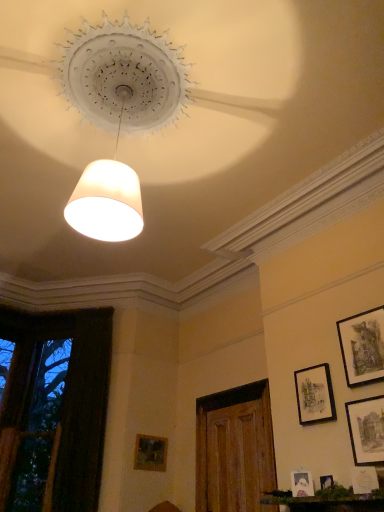
The width and height of the screenshot is (384, 512). What do you see at coordinates (234, 449) in the screenshot?
I see `wooden door at center` at bounding box center [234, 449].

Measure the distance between point [295,483] and camera.

Point [295,483] is 3.01 meters away from camera.

Find the location of a particular element. The width and height of the screenshot is (384, 512). matte white picture frame at lower right, arranged as the 3th picture frame when viewed from the front is located at coordinates (302, 484).

Describe the element at coordinates (366, 430) in the screenshot. The width and height of the screenshot is (384, 512). I see `matte black picture frame at lower right, the 2th picture frame from the right` at that location.

What do you see at coordinates (150, 453) in the screenshot? I see `wooden picture frame at lower center, which appears as the first picture frame when viewed from the back` at bounding box center [150, 453].

Where is `transparent glass window at left`? The width and height of the screenshot is (384, 512). transparent glass window at left is located at coordinates (53, 408).

Based on the photo, from a real-world perspective, relative to transparent glass window at left, is matte black picture frame at lower right, which ranks as the second picture frame in front-to-back order, vertically above or below?

From a real-world perspective, matte black picture frame at lower right, which ranks as the second picture frame in front-to-back order, is physically below transparent glass window at left.

In terms of size, does matte black picture frame at lower right, which ranks as the second picture frame in front-to-back order, appear bigger or smaller than transparent glass window at left?

Clearly, matte black picture frame at lower right, which ranks as the second picture frame in front-to-back order, is smaller in size than transparent glass window at left.

From the image's perspective, relative to transparent glass window at left, is matte black picture frame at lower right, which ranks as the second picture frame in front-to-back order, above or below?

matte black picture frame at lower right, which ranks as the second picture frame in front-to-back order, is above transparent glass window at left.

Can you confirm if matte black picture frame at lower right, which appears as the sixth picture frame when viewed from the left, is positioned to the left of transparent glass window at left?

In fact, matte black picture frame at lower right, which appears as the sixth picture frame when viewed from the left, is to the right of transparent glass window at left.

Is matte black picture frame at lower right, which is counted as the second picture frame, starting from the back, thinner than white matte lampshade at upper center?

Correct, the width of matte black picture frame at lower right, which is counted as the second picture frame, starting from the back, is less than that of white matte lampshade at upper center.

Is matte black picture frame at lower right, which is counted as the second picture frame, starting from the back, aimed at white matte lampshade at upper center?

Yes, matte black picture frame at lower right, which is counted as the second picture frame, starting from the back, is aimed at white matte lampshade at upper center.

Which of these two, matte black picture frame at lower right, which is the 4th picture frame in right-to-left order, or white matte lampshade at upper center, stands shorter?

Standing shorter between the two is matte black picture frame at lower right, which is the 4th picture frame in right-to-left order.

From the image's perspective, between matte black picture frame at lower right, acting as the sixth picture frame starting from the front, and white matte lampshade at upper center, who is located below?

matte black picture frame at lower right, acting as the sixth picture frame starting from the front.

Is matte black picture frame at lower right, the 2th picture frame from the right, looking in the opposite direction of matte white picture frame at lower right, which is counted as the 1th picture frame, starting from the front?

No, matte black picture frame at lower right, the 2th picture frame from the right, is not facing away from matte white picture frame at lower right, which is counted as the 1th picture frame, starting from the front.

Does matte black picture frame at lower right, the 2th picture frame from the right, appear on the right side of matte white picture frame at lower right, the 7th picture frame positioned from the back?

Yes, matte black picture frame at lower right, the 2th picture frame from the right, is to the right of matte white picture frame at lower right, the 7th picture frame positioned from the back.

From the image's perspective, which one is positioned lower, matte black picture frame at lower right, which ranks as the second picture frame in front-to-back order, or matte white picture frame at lower right, the 7th picture frame positioned from the back?

matte white picture frame at lower right, the 7th picture frame positioned from the back, appears lower in the image.

From the image's perspective, is white matte lampshade at upper center on wooden picture frame at lower center, which appears as the 7th picture frame when viewed from the front?

Yes, from the image's perspective, white matte lampshade at upper center is over wooden picture frame at lower center, which appears as the 7th picture frame when viewed from the front.

How far apart are white matte lampshade at upper center and wooden picture frame at lower center, which ranks as the first picture frame in left-to-right order?

A distance of 11.65 feet exists between white matte lampshade at upper center and wooden picture frame at lower center, which ranks as the first picture frame in left-to-right order.

Can you confirm if white matte lampshade at upper center is thinner than wooden picture frame at lower center, which ranks as the first picture frame in left-to-right order?

No.

Is white matte lampshade at upper center located outside wooden picture frame at lower center, which appears as the first picture frame when viewed from the back?

Absolutely, white matte lampshade at upper center is external to wooden picture frame at lower center, which appears as the first picture frame when viewed from the back.

Can you confirm if matte black picture frame at lower right, which appears as the sixth picture frame when viewed from the left, is bigger than matte black picture frame at lower right, acting as the 4th picture frame starting from the left?

Incorrect, matte black picture frame at lower right, which appears as the sixth picture frame when viewed from the left, is not larger than matte black picture frame at lower right, acting as the 4th picture frame starting from the left.

How distant is matte black picture frame at lower right, which appears as the sixth picture frame when viewed from the left, from matte black picture frame at lower right, acting as the sixth picture frame starting from the front?

A distance of 12.08 inches exists between matte black picture frame at lower right, which appears as the sixth picture frame when viewed from the left, and matte black picture frame at lower right, acting as the sixth picture frame starting from the front.

Which is more to the right, matte black picture frame at lower right, the sixth picture frame positioned from the back, or matte black picture frame at lower right, acting as the 4th picture frame starting from the left?

matte black picture frame at lower right, the sixth picture frame positioned from the back, is more to the right.

Is matte black picture frame at lower right, which ranks as the second picture frame in front-to-back order, situated inside matte black picture frame at lower right, acting as the 4th picture frame starting from the left, or outside?

The correct answer is: outside.

Is point (319, 403) closer to camera compared to point (354, 472)?

No, (319, 403) is further to viewer.

How distant is matte black picture frame at lower right, acting as the 4th picture frame starting from the left, from matte white picture frame at lower right, which appears as the 5th picture frame when viewed from the left?

They are 22.30 inches apart.

Is matte black picture frame at lower right, acting as the 4th picture frame starting from the left, positioned far away from matte white picture frame at lower right, which appears as the 5th picture frame when viewed from the left?

No, matte black picture frame at lower right, acting as the 4th picture frame starting from the left, is not far away from matte white picture frame at lower right, which appears as the 5th picture frame when viewed from the left.

Considering the relative sizes of matte black picture frame at lower right, which is counted as the second picture frame, starting from the back, and matte white picture frame at lower right, the 7th picture frame positioned from the back, in the image provided, is matte black picture frame at lower right, which is counted as the second picture frame, starting from the back, smaller than matte white picture frame at lower right, the 7th picture frame positioned from the back,?

Actually, matte black picture frame at lower right, which is counted as the second picture frame, starting from the back, might be larger than matte white picture frame at lower right, the 7th picture frame positioned from the back.

Does matte black picture frame at lower right, which ranks as the fifth picture frame in front-to-back order, touch transparent glass window at left?

matte black picture frame at lower right, which ranks as the fifth picture frame in front-to-back order, and transparent glass window at left are clearly separated.

Which of these two, matte black picture frame at lower right, the 3th picture frame positioned from the back, or transparent glass window at left, is bigger?

Bigger between the two is transparent glass window at left.

Could you tell me if matte black picture frame at lower right, positioned as the 3th picture frame in left-to-right order, is turned towards transparent glass window at left?

No, matte black picture frame at lower right, positioned as the 3th picture frame in left-to-right order, is not turned towards transparent glass window at left.

From the image's perspective, is matte black picture frame at lower right, acting as the fifth picture frame starting from the right, positioned above or below transparent glass window at left?

Based on their image positions, matte black picture frame at lower right, acting as the fifth picture frame starting from the right, is located above transparent glass window at left.

This screenshot has width=384, height=512. What are the coordinates of `the 4th picture frame positioned above the transparent glass window at left (from the image's perspective)` in the screenshot? It's located at (366, 430).

Where is `lamp in front of the matte black picture frame at lower right, acting as the sixth picture frame starting from the front`? The image size is (384, 512). lamp in front of the matte black picture frame at lower right, acting as the sixth picture frame starting from the front is located at coordinates (119, 116).

Looking at the image, which one is located further to white matte lampshade at upper center, matte black picture frame at lower right, acting as the 4th picture frame starting from the left, or watercolor paper picture frame at upper right, which is the first picture frame in right-to-left order?

Based on the image, matte black picture frame at lower right, acting as the 4th picture frame starting from the left, appears to be further to white matte lampshade at upper center.

Which object lies further to the anchor point wooden door at center, matte black picture frame at lower right, acting as the 4th picture frame starting from the left, or matte black picture frame at lower right, which ranks as the second picture frame in front-to-back order?

matte black picture frame at lower right, which ranks as the second picture frame in front-to-back order, is further to wooden door at center.

Considering their positions, is matte white picture frame at lower right, which is the 6th picture frame in right-to-left order, positioned closer to matte white picture frame at lower right, which is counted as the 1th picture frame, starting from the front, than watercolor paper picture frame at upper right, the 7th picture frame when ordered from left to right?

matte white picture frame at lower right, which is the 6th picture frame in right-to-left order.

Based on their spatial positions, is transparent glass window at left or wooden picture frame at lower center, which appears as the first picture frame when viewed from the back, further from matte black picture frame at lower right, which appears as the sixth picture frame when viewed from the left?

transparent glass window at left is further to matte black picture frame at lower right, which appears as the sixth picture frame when viewed from the left.

Looking at the image, which one is located further to wooden picture frame at lower center, which appears as the seventh picture frame when viewed from the right, watercolor paper picture frame at upper right, placed as the 4th picture frame when sorted from back to front, or white matte lampshade at upper center?

Based on the image, white matte lampshade at upper center appears to be further to wooden picture frame at lower center, which appears as the seventh picture frame when viewed from the right.

Consider the image. Considering their positions, is matte black picture frame at lower right, the sixth picture frame positioned from the back, positioned further to watercolor paper picture frame at upper right, placed as the 4th picture frame when sorted from back to front, than matte black picture frame at lower right, the 3th picture frame positioned from the back?

matte black picture frame at lower right, the 3th picture frame positioned from the back, lies further to watercolor paper picture frame at upper right, placed as the 4th picture frame when sorted from back to front, than the other object.

Which object lies further to the anchor point matte black picture frame at lower right, which is counted as the second picture frame, starting from the back, white matte lampshade at upper center or wooden picture frame at lower center, which appears as the first picture frame when viewed from the back?

white matte lampshade at upper center.

When comparing their distances from matte white picture frame at lower right, which appears as the 5th picture frame when viewed from the left, does matte black picture frame at lower right, acting as the fifth picture frame starting from the right, or wooden picture frame at lower center, which ranks as the first picture frame in left-to-right order, seem further?

wooden picture frame at lower center, which ranks as the first picture frame in left-to-right order.

Find the location of a particular element. The image size is (384, 512). glass door situated between wooden picture frame at lower center, which appears as the 7th picture frame when viewed from the front, and watercolor paper picture frame at upper right, the 7th picture frame when ordered from left to right, from left to right is located at coordinates (234, 449).

You are a GUI agent. You are given a task and a screenshot of the screen. Output one action in this format:
    pyautogui.click(x=<x>, y=<y>)
    Task: Click on the glass door positioned between matte black picture frame at lower right, the 2th picture frame from the right, and wooden picture frame at lower center, which appears as the first picture frame when viewed from the back, from near to far
    This screenshot has height=512, width=384.
    Given the screenshot: What is the action you would take?
    pyautogui.click(x=234, y=449)

Locate an element on the screen. The width and height of the screenshot is (384, 512). picture frame between matte black picture frame at lower right, the 3th picture frame positioned from the back, and wooden picture frame at lower center, which appears as the 7th picture frame when viewed from the front, in the front-back direction is located at coordinates (314, 395).

You are a GUI agent. You are given a task and a screenshot of the screen. Output one action in this format:
    pyautogui.click(x=<x>, y=<y>)
    Task: Click on the glass door located between transparent glass window at left and matte black picture frame at lower right, which appears as the sixth picture frame when viewed from the left, in the left-right direction
    
    Given the screenshot: What is the action you would take?
    pyautogui.click(x=234, y=449)